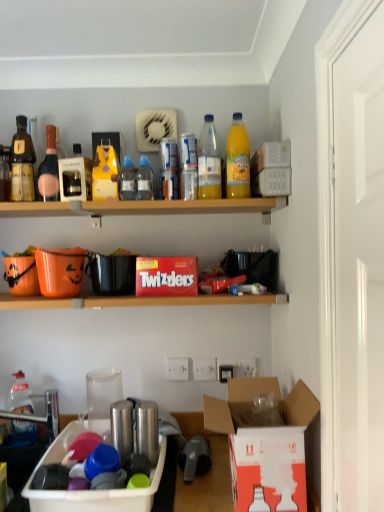
Question: Can you confirm if transparent plastic bottle at upper center, which ranks as the fifth bottle in top-to-bottom order, is thinner than translucent plastic bottle at upper center, positioned as the 4th bottle in left-to-right order?

Choices:
 (A) yes
 (B) no

Answer: (A)

Question: Is transparent plastic bottle at upper center, arranged as the 5th bottle when viewed from the left, aimed at translucent plastic bottle at upper center, positioned as the 4th bottle in left-to-right order?

Choices:
 (A) no
 (B) yes

Answer: (A)

Question: Can we say transparent plastic bottle at upper center, arranged as the second bottle when viewed from the right, lies outside translucent plastic bottle at upper center, marked as the third bottle in a right-to-left arrangement?

Choices:
 (A) no
 (B) yes

Answer: (B)

Question: Is transparent plastic bottle at upper center, which ranks as the fifth bottle in top-to-bottom order, wider than translucent plastic bottle at upper center, marked as the third bottle in a right-to-left arrangement?

Choices:
 (A) yes
 (B) no

Answer: (B)

Question: Is transparent plastic bottle at upper center, arranged as the 5th bottle when viewed from the left, to the left of translucent plastic bottle at upper center, positioned as the 4th bottle in left-to-right order, from the viewer's perspective?

Choices:
 (A) no
 (B) yes

Answer: (A)

Question: In terms of size, does orange matte plastic bucket at left appear bigger or smaller than wooden shelf at upper center, the 2th shelf ordered from the bottom?

Choices:
 (A) small
 (B) big

Answer: (A)

Question: Considering their positions, is orange matte plastic bucket at left located in front of or behind wooden shelf at upper center, which is counted as the first shelf, starting from the top?

Choices:
 (A) behind
 (B) front

Answer: (A)

Question: Would you say orange matte plastic bucket at left is to the left or to the right of wooden shelf at upper center, which is counted as the first shelf, starting from the top, in the picture?

Choices:
 (A) left
 (B) right

Answer: (A)

Question: From the image's perspective, is orange matte plastic bucket at left located above or below wooden shelf at upper center, which is counted as the first shelf, starting from the top?

Choices:
 (A) below
 (B) above

Answer: (A)

Question: Is point (332, 166) closer or farther from the camera than point (94, 210)?

Choices:
 (A) closer
 (B) farther

Answer: (A)

Question: From the image's perspective, is white glossy door at upper right above or below wooden shelf at upper center, which is counted as the first shelf, starting from the top?

Choices:
 (A) below
 (B) above

Answer: (A)

Question: From a real-world perspective, is white glossy door at upper right positioned above or below wooden shelf at upper center, which is counted as the first shelf, starting from the top?

Choices:
 (A) above
 (B) below

Answer: (B)

Question: Considering their positions, is white glossy door at upper right located in front of or behind wooden shelf at upper center, the 2th shelf ordered from the bottom?

Choices:
 (A) front
 (B) behind

Answer: (A)

Question: Is transparent plastic bottle at upper center, which ranks as the fifth bottle in top-to-bottom order, wider or thinner than red cardboard twizzlers at center, the 1th box from the top?

Choices:
 (A) thin
 (B) wide

Answer: (A)

Question: Based on their sizes in the image, would you say transparent plastic bottle at upper center, arranged as the second bottle when viewed from the right, is bigger or smaller than red cardboard twizzlers at center, acting as the 3th box starting from the bottom?

Choices:
 (A) big
 (B) small

Answer: (B)